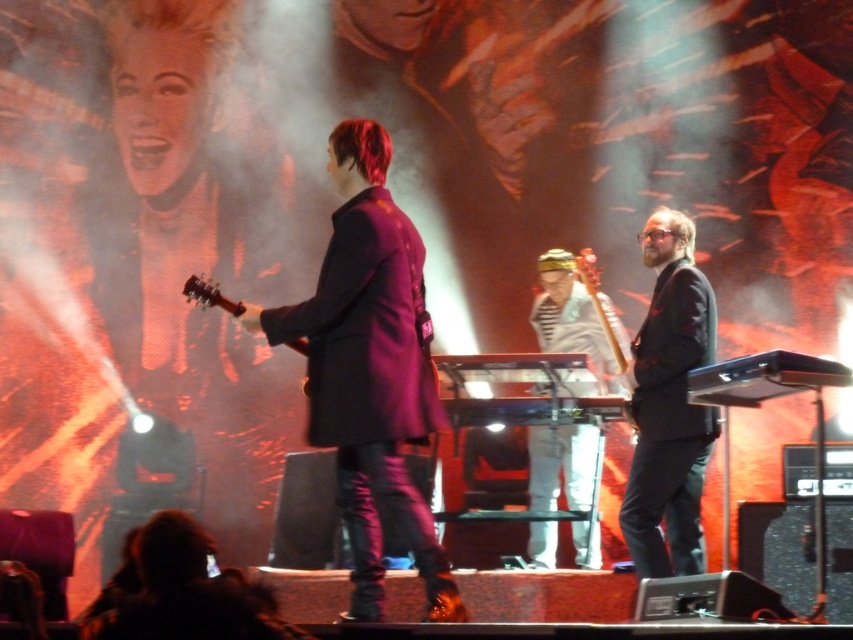
This screenshot has width=853, height=640. What do you see at coordinates (669, 404) in the screenshot?
I see `black matte suit at right` at bounding box center [669, 404].

Is black matte suit at right in front of white striped shirt at center?

Yes, it is in front of white striped shirt at center.

Describe the element at coordinates (669, 404) in the screenshot. I see `black matte suit at right` at that location.

Image resolution: width=853 pixels, height=640 pixels. In order to click on black matte suit at right in this screenshot , I will do `click(669, 404)`.

Does purple matte coat at center have a larger size compared to white striped shirt at center?

Indeed, purple matte coat at center has a larger size compared to white striped shirt at center.

This screenshot has height=640, width=853. Describe the element at coordinates (370, 369) in the screenshot. I see `purple matte coat at center` at that location.

Where is `purple matte coat at center`? purple matte coat at center is located at coordinates (370, 369).

Does purple matte coat at center lie behind black matte suit at right?

No, purple matte coat at center is in front of black matte suit at right.

Who is positioned more to the left, purple matte coat at center or black matte suit at right?

From the viewer's perspective, purple matte coat at center appears more on the left side.

Locate an element on the screen. The image size is (853, 640). purple matte coat at center is located at coordinates click(x=370, y=369).